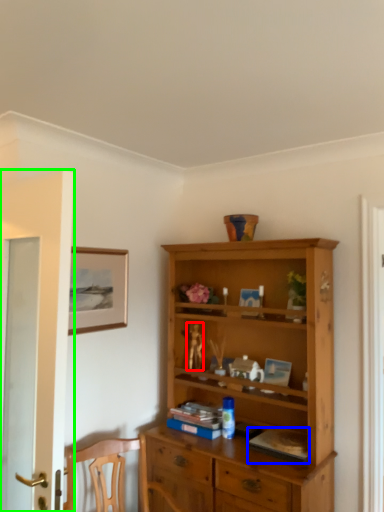
Question: Which object is the closest to the toy (highlighted by a red box)? Choose among these: book (highlighted by a blue box) or door (highlighted by a green box).

Choices:
 (A) book
 (B) door

Answer: (A)